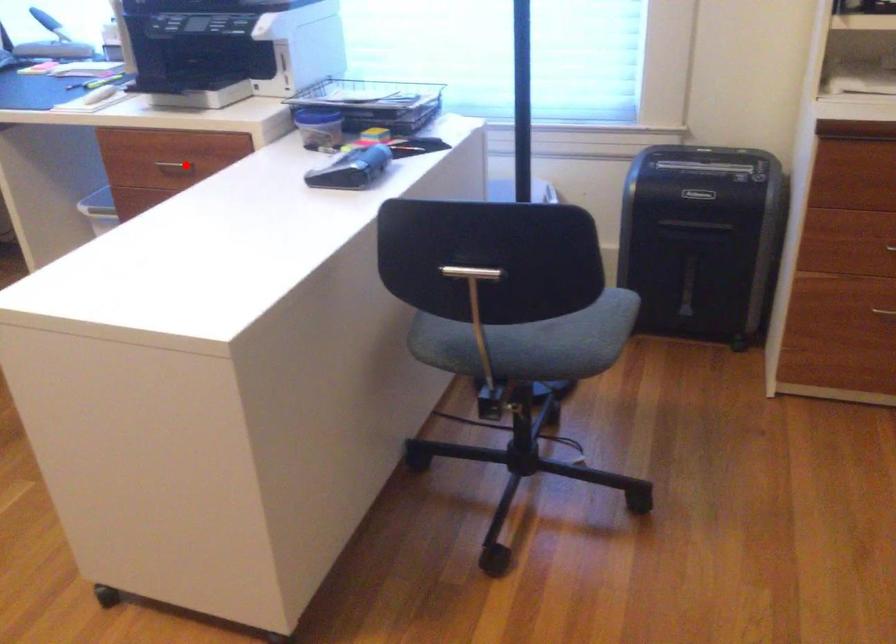
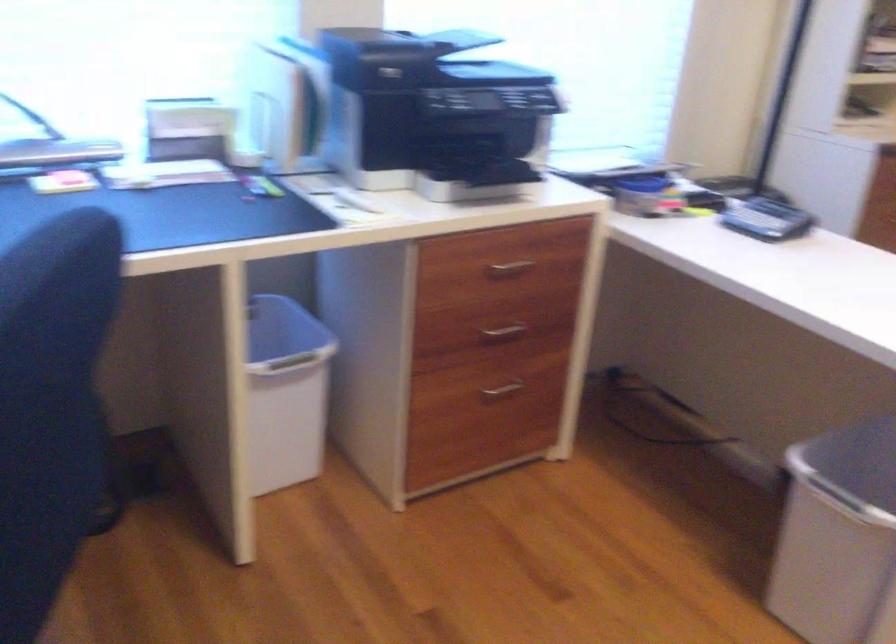
Locate, in the second image, the point that corresponds to the highlighted location in the first image.

(510, 268)